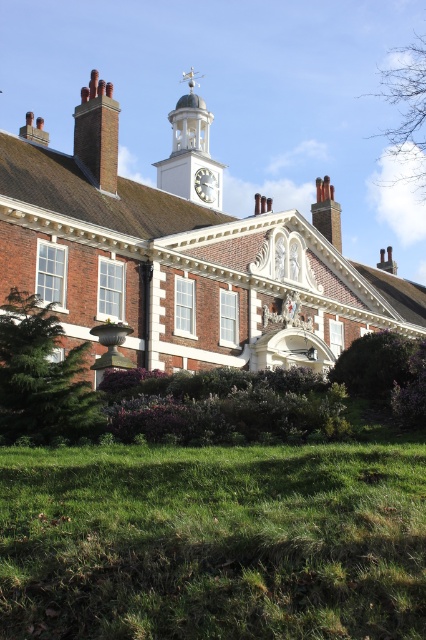
Which is behind, point (192, 436) or point (2, 384)?

The point (192, 436) is more distant.

Between purple leafy hedge at lower center and green leafy tree at lower left, which one appears on the left side from the viewer's perspective?

green leafy tree at lower left is more to the left.

The height and width of the screenshot is (640, 426). What are the coordinates of `purple leafy hedge at lower center` in the screenshot? It's located at (224, 406).

Between purple leafy hedge at lower center and dark brown brick chimney at upper center, which one has more height?

Standing taller between the two is dark brown brick chimney at upper center.

Is purple leafy hedge at lower center positioned at the back of dark brown brick chimney at upper center?

No, purple leafy hedge at lower center is in front of dark brown brick chimney at upper center.

What do you see at coordinates (224, 406) in the screenshot? I see `purple leafy hedge at lower center` at bounding box center [224, 406].

Identify the location of purple leafy hedge at lower center. The height and width of the screenshot is (640, 426). (224, 406).

Which is more to the left, white glossy clock tower at upper center or dark brown brick chimney at upper center?

white glossy clock tower at upper center

Is point (189, 132) closer to viewer compared to point (327, 198)?

Yes.

The image size is (426, 640). I want to click on white glossy clock tower at upper center, so click(x=190, y=152).